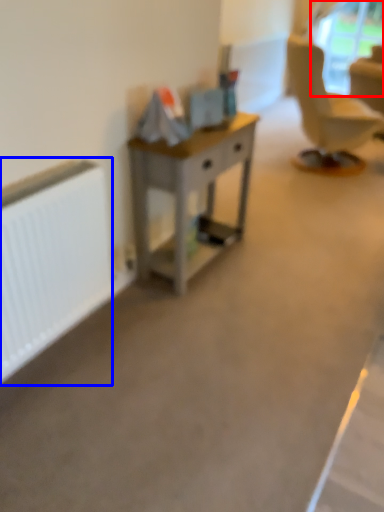
Question: Among these objects, which one is nearest to the camera, window screen (highlighted by a red box) or radiator (highlighted by a blue box)?

Choices:
 (A) window screen
 (B) radiator

Answer: (B)